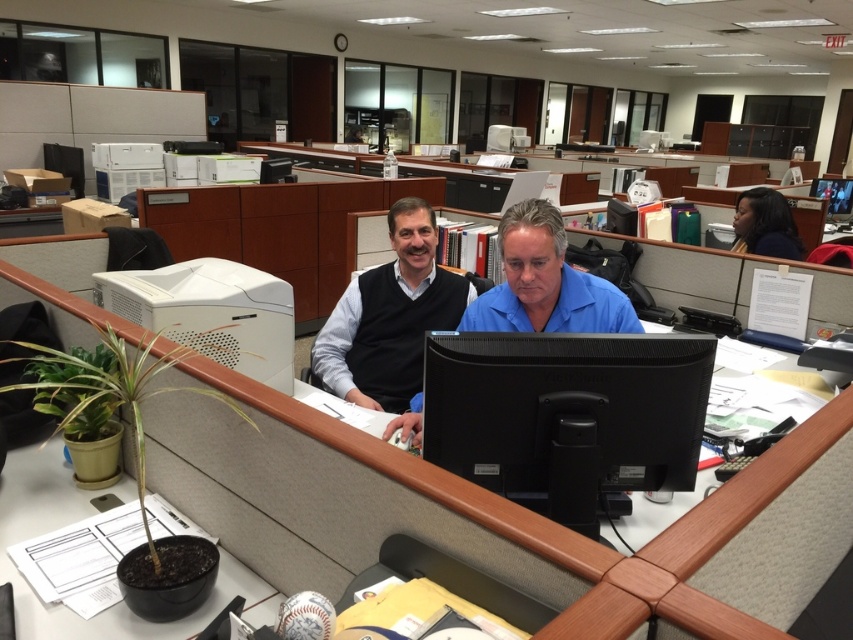
You are an office worker trying to decide where to place a new rectangular box that is 10 cm thick. The box must be placed either on the matte black sweater at center or on the black glossy computer monitor at upper right. Based on their thickness, which object can safely support the box without it hanging over the edge?

The matte black sweater at center is thinner than the black glossy computer monitor at upper right. Since the box is 10 cm thick, it needs a surface at least as thick as the box. The black glossy computer monitor at upper right is thicker, so placing the box there would provide enough support. The matte black sweater at center is too thin to safely support the box without it hanging over the edge.

You are organizing a desk and need to place the matte black sweater at center and the white matte desktop computer at upper left. According to their positions, which object is closer to the right side of the desk?

The matte black sweater at center is closer to the right side of the desk because it is positioned to the right of the white matte desktop computer at upper left.

You are an office manager checking the layout of the workspace. You notice the matte black sweater at center and the blue matte shirt at center. Which one takes up more space on the desk?

The matte black sweater at center is larger in size than the blue matte shirt at center, so it takes up more space on the desk.